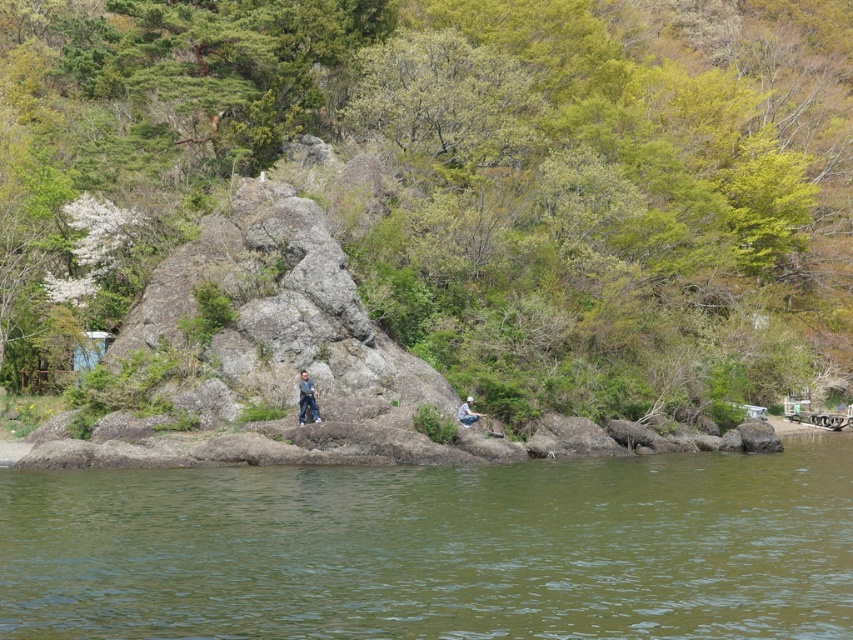
Question: Which object is farther from the camera taking this photo?

Choices:
 (A) greenish-brown water at lower center
 (B) light gray stone person at center
 (C) green leafy tree at upper center

Answer: (B)

Question: Does green leafy tree at upper center appear under light gray stone person at center?

Choices:
 (A) no
 (B) yes

Answer: (A)

Question: Does greenish-brown water at lower center have a larger size compared to denim pants at center?

Choices:
 (A) yes
 (B) no

Answer: (A)

Question: Is green leafy tree at upper center positioned in front of greenish-brown water at lower center?

Choices:
 (A) no
 (B) yes

Answer: (A)

Question: Which point is closer to the camera taking this photo?

Choices:
 (A) [x=28, y=348]
 (B) [x=482, y=584]
 (C) [x=473, y=420]
 (D) [x=300, y=412]

Answer: (B)

Question: Considering the real-world distances, which object is farthest from the denim pants at center?

Choices:
 (A) greenish-brown water at lower center
 (B) light gray stone person at center

Answer: (A)